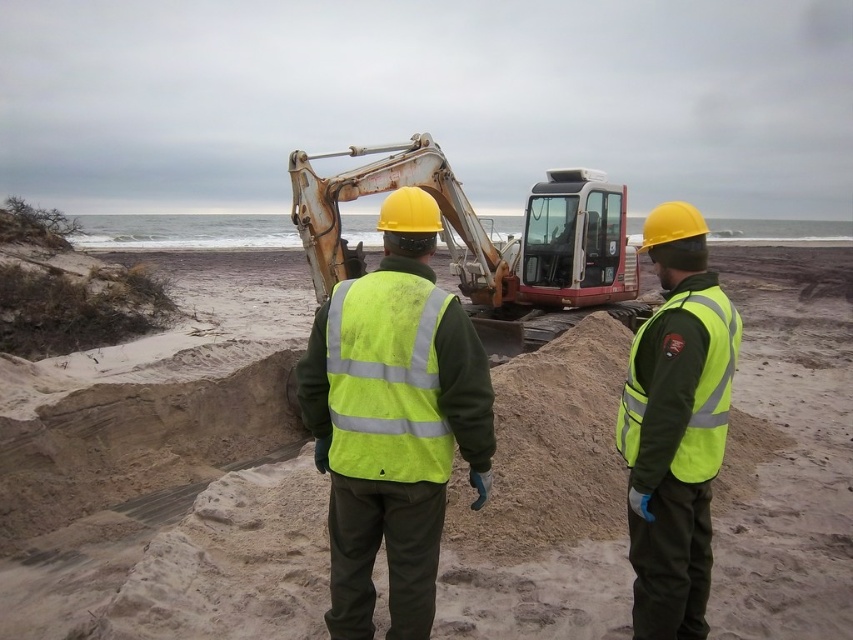
You are a construction worker standing at the point with coordinates point (323, 288). You need to walk to the point with coordinates point (633, 534). Which direction should you move relative to your current position?

You should move forward because point (633, 534) is in front of point (323, 288).